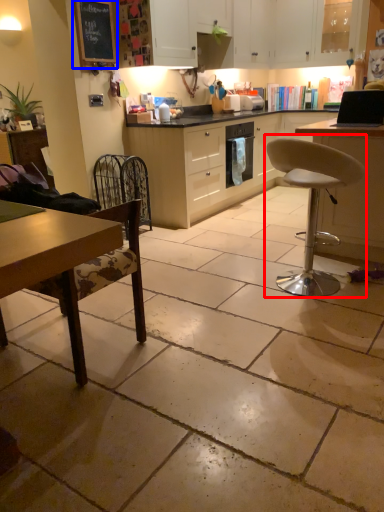
Question: Which of the following is the closest to the observer, chair (highlighted by a red box) or bulletin board (highlighted by a blue box)?

Choices:
 (A) chair
 (B) bulletin board

Answer: (A)